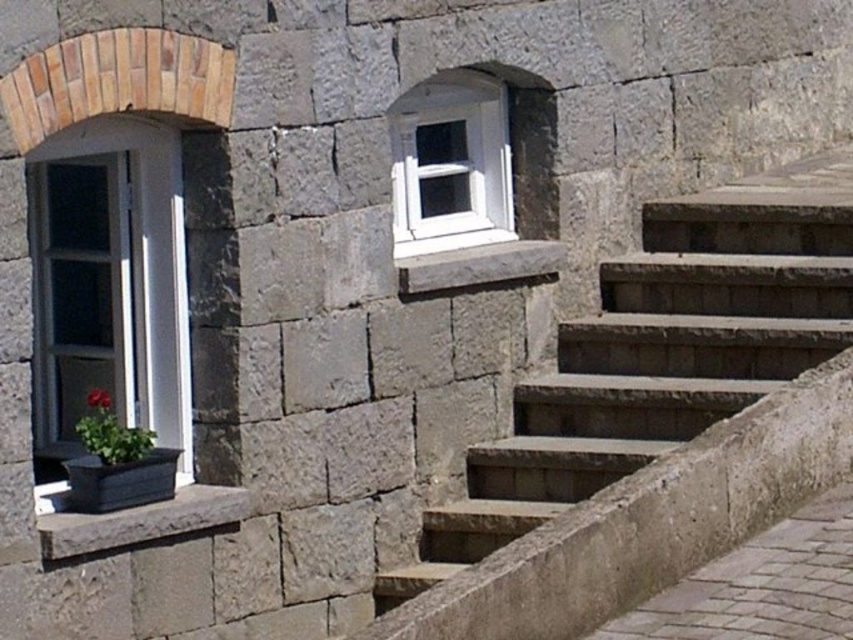
Is matte white window at left wider than matte black planter at lower left?

Yes.

Between matte white window at left and matte black planter at lower left, which one has less height?

matte black planter at lower left is shorter.

The height and width of the screenshot is (640, 853). What do you see at coordinates (109, 280) in the screenshot?
I see `matte white window at left` at bounding box center [109, 280].

I want to click on matte white window at left, so click(x=109, y=280).

Measure the distance between gray stone stairs at center and white plastic window at upper center.

gray stone stairs at center and white plastic window at upper center are 1.20 meters apart from each other.

Can you confirm if gray stone stairs at center is bigger than white plastic window at upper center?

Yes, gray stone stairs at center is bigger than white plastic window at upper center.

Where is `gray stone stairs at center`? gray stone stairs at center is located at coordinates (643, 417).

Identify the location of gray stone stairs at center. (643, 417).

Is white plastic window at upper center to the left of smooth stone window sill at lower left from the viewer's perspective?

No, white plastic window at upper center is not to the left of smooth stone window sill at lower left.

Is point (421, 113) behind point (189, 522)?

Yes, it is.

Locate an element on the screen. Image resolution: width=853 pixels, height=640 pixels. white plastic window at upper center is located at coordinates (450, 164).